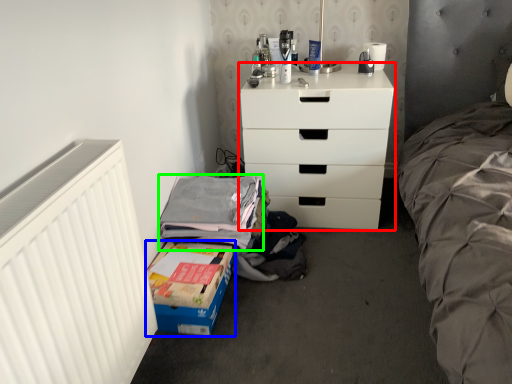
Question: Which object is the farthest from chest of drawers (highlighted by a red box)? Choose among these: box (highlighted by a blue box) or clothing (highlighted by a green box).

Choices:
 (A) box
 (B) clothing

Answer: (A)